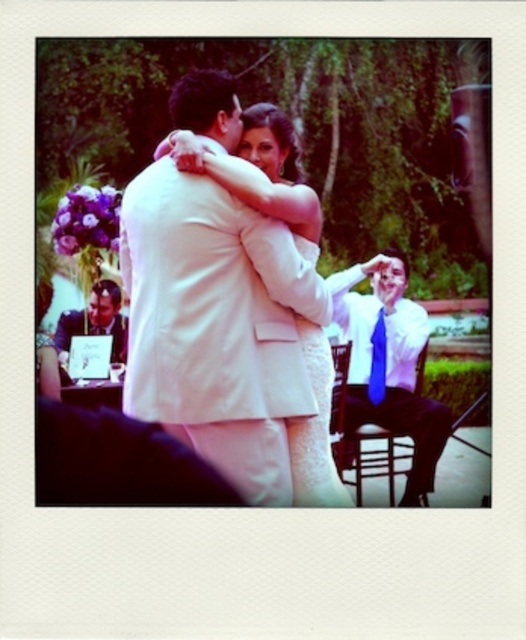
You are a photographer at the wedding and need to ensure that both the blue silk tie at right and the white textured dress at center are visible in your photo. Considering their sizes, which one might you need to adjust your camera angle to better include?

The blue silk tie at right is larger in size than the white textured dress at center, so you might need to adjust your camera angle to better include the blue silk tie at right since it occupies more space in the frame.

You are a photographer at the wedding and want to capture the couple in the center and the guest with the blue silk tie at right. Where should you position your camera to include both in the frame?

The blue silk tie at right is located at point [389,364]. To include both the central couple and the guest with the blue silk tie at right, position your camera centrally and ensure the frame extends to the right to include the guest at coordinate [389,364].